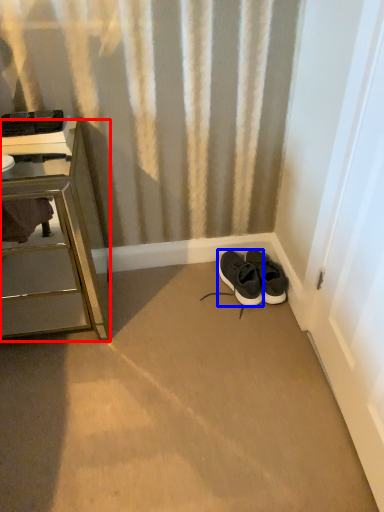
Question: Which of the following is the closest to the observer, chest of drawers (highlighted by a red box) or shoe (highlighted by a blue box)?

Choices:
 (A) chest of drawers
 (B) shoe

Answer: (A)